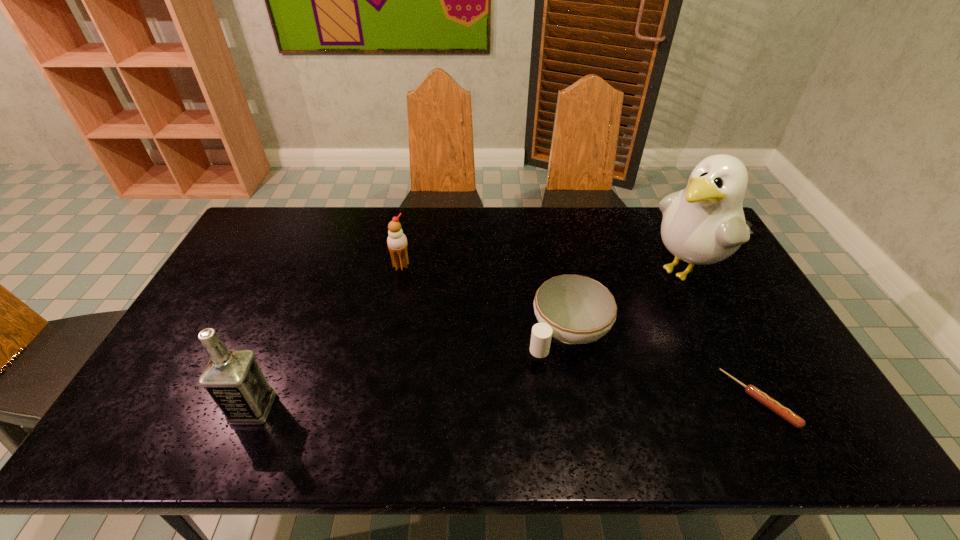
You are a GUI agent. You are given a task and a screenshot of the screen. Output one action in this format:
    pyautogui.click(x=<x>, y=<y>)
    Task: Click on the free space between the shortest object and the second shortest object
    The image size is (960, 540).
    Given the screenshot: What is the action you would take?
    pyautogui.click(x=663, y=366)

Where is `object that is the closest to the leftmost object`? The height and width of the screenshot is (540, 960). object that is the closest to the leftmost object is located at coordinates (397, 242).

You are a GUI agent. You are given a task and a screenshot of the screen. Output one action in this format:
    pyautogui.click(x=<x>, y=<y>)
    Task: Click on the object that is the fourth closest to the gull
    This screenshot has height=540, width=960.
    Given the screenshot: What is the action you would take?
    pyautogui.click(x=233, y=378)

Locate an element on the screen. vacant space that satisfies the following two spatial constraints: 1. on the front side of the gull; 2. on the right side of the third shortest object is located at coordinates (400, 270).

The image size is (960, 540). What are the coordinates of `free location that satisfies the following two spatial constraints: 1. on the front side of the second shortest object; 2. on the left side of the shortest object` in the screenshot? It's located at (580, 400).

The width and height of the screenshot is (960, 540). What are the coordinates of `free space that satisfies the following two spatial constraints: 1. on the front side of the fourth object from right to left; 2. on the right side of the tallest object` in the screenshot? It's located at (400, 270).